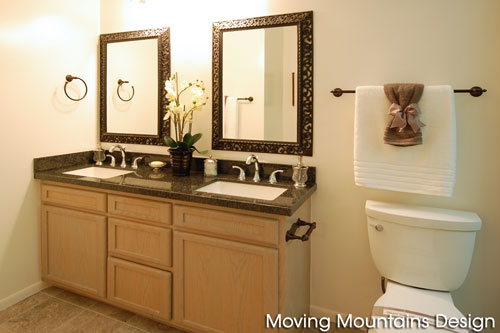
Find the location of a particular element. This screenshot has width=500, height=333. white bath towel is located at coordinates (364, 136).